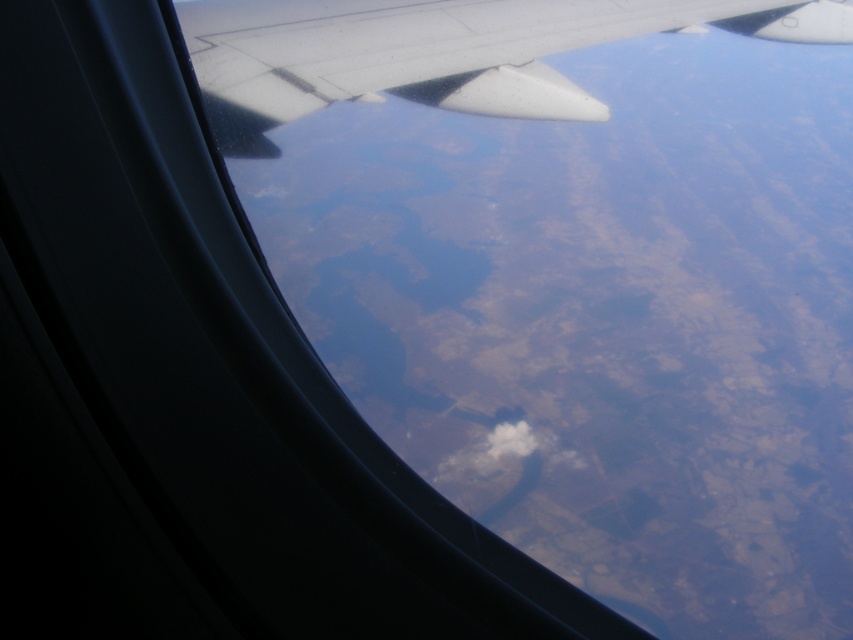
Question: Is white matte wing at upper center wider than white fluffy cloud at center?

Choices:
 (A) yes
 (B) no

Answer: (B)

Question: In this image, where is white matte wing at upper center located relative to white fluffy cloud at center?

Choices:
 (A) below
 (B) above

Answer: (B)

Question: In this image, where is white matte wing at upper center located relative to white fluffy cloud at center?

Choices:
 (A) right
 (B) left

Answer: (B)

Question: Which object is closer to the camera taking this photo?

Choices:
 (A) white matte wing at upper center
 (B) white fluffy cloud at center

Answer: (A)